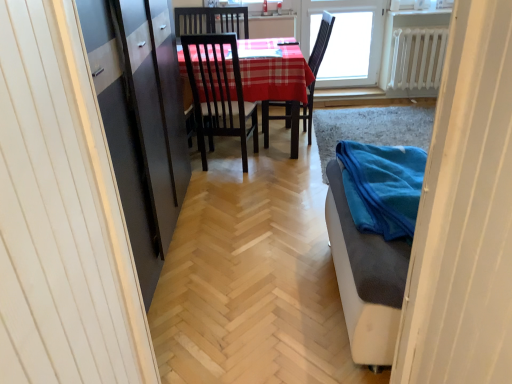
Where is `blue fabric at lower right`? This screenshot has height=384, width=512. blue fabric at lower right is located at coordinates (464, 214).

In order to face blue fabric at lower right, should I rotate leftwards or rightwards?

To align with it, rotate right about 19.150°.

The width and height of the screenshot is (512, 384). What do you see at coordinates (345, 40) in the screenshot?
I see `transparent glass window at upper center` at bounding box center [345, 40].

Where is `blue fabric at lower right`? blue fabric at lower right is located at coordinates (464, 214).

Is white metallic radiator at upper right touching transparent glass window at upper center?

white metallic radiator at upper right and transparent glass window at upper center are clearly separated.

Is white metallic radiator at upper right in front of or behind transparent glass window at upper center in the image?

white metallic radiator at upper right is in front of transparent glass window at upper center.

In the scene shown: Is white metallic radiator at upper right shorter than transparent glass window at upper center?

Yes.

You are a GUI agent. You are given a task and a screenshot of the screen. Output one action in this format:
    pyautogui.click(x=<x>, y=<y>)
    Task: Click on the radiator on the right of the transparent glass window at upper center
    The height and width of the screenshot is (384, 512).
    Given the screenshot: What is the action you would take?
    pyautogui.click(x=416, y=60)

Considering the positions of objects blue fabric at lower right and white metallic radiator at upper right in the image provided, who is more to the right, blue fabric at lower right or white metallic radiator at upper right?

From the viewer's perspective, white metallic radiator at upper right appears more on the right side.

From a real-world perspective, does blue fabric at lower right sit lower than white metallic radiator at upper right?

Yes.

In the scene shown: From the image's perspective, which is above, blue fabric at lower right or white metallic radiator at upper right?

white metallic radiator at upper right, from the image's perspective.

Considering their positions, is blue fabric at lower right located in front of or behind white metallic radiator at upper right?

blue fabric at lower right is positioned closer to the viewer than white metallic radiator at upper right.

From the picture: From a real-world perspective, is blue fabric at lower right located higher than transparent glass window at upper center?

No, from a real-world perspective, blue fabric at lower right is not above transparent glass window at upper center.

How much distance is there between blue fabric at lower right and transparent glass window at upper center?

blue fabric at lower right and transparent glass window at upper center are 11.35 feet apart.

Is blue fabric at lower right inside the boundaries of transparent glass window at upper center, or outside?

blue fabric at lower right is not inside transparent glass window at upper center, it's outside.

Is blue fabric at lower right in front of transparent glass window at upper center?

Yes, it is in front of transparent glass window at upper center.

Based on the photo, considering the positions of objects transparent glass window at upper center and blue fabric at lower right in the image provided, who is more to the left, transparent glass window at upper center or blue fabric at lower right?

blue fabric at lower right is more to the left.

Is transparent glass window at upper center outside of blue fabric at lower right?

Yes, transparent glass window at upper center is not within blue fabric at lower right.

Can you confirm if transparent glass window at upper center is shorter than blue fabric at lower right?

Yes, transparent glass window at upper center is shorter than blue fabric at lower right.

Does transparent glass window at upper center have a larger size compared to blue fabric at lower right?

No, transparent glass window at upper center is not bigger than blue fabric at lower right.

From the picture: Is white metallic radiator at upper right inside or outside of blue fabric at lower right?

white metallic radiator at upper right is not enclosed by blue fabric at lower right.

Which is closer to the camera, [397,76] or [402,307]?

Point [397,76] appears to be farther away from the viewer than point [402,307].

Considering the sizes of objects white metallic radiator at upper right and blue fabric at lower right in the image provided, who is thinner, white metallic radiator at upper right or blue fabric at lower right?

white metallic radiator at upper right is thinner.

Considering the positions of objects transparent glass window at upper center and white metallic radiator at upper right in the image provided, who is more to the right, transparent glass window at upper center or white metallic radiator at upper right?

white metallic radiator at upper right.

From the picture: From a real-world perspective, is transparent glass window at upper center under white metallic radiator at upper right?

No.

Does transparent glass window at upper center have a smaller size compared to white metallic radiator at upper right?

No.

Can you tell me how much transparent glass window at upper center and white metallic radiator at upper right differ in facing direction?

0.0127 degrees.

The height and width of the screenshot is (384, 512). Identify the location of radiator directly beneath the transparent glass window at upper center (from a real-world perspective). (416, 60).

Identify the location of radiator behind the blue fabric at lower right. (416, 60).

Considering their positions, is white metallic radiator at upper right positioned further to blue fabric at lower right than transparent glass window at upper center?

white metallic radiator at upper right is further to blue fabric at lower right.

Which object lies nearer to the anchor point transparent glass window at upper center, white metallic radiator at upper right or blue fabric at lower right?

white metallic radiator at upper right.

Considering their positions, is transparent glass window at upper center positioned closer to blue fabric at lower right than white metallic radiator at upper right?

The object closer to blue fabric at lower right is transparent glass window at upper center.

Looking at the image, which one is located closer to white metallic radiator at upper right, blue fabric at lower right or transparent glass window at upper center?

transparent glass window at upper center is closer to white metallic radiator at upper right.

Estimate the real-world distances between objects in this image. Which object is closer to white metallic radiator at upper right, transparent glass window at upper center or blue fabric at lower right?

transparent glass window at upper center is closer to white metallic radiator at upper right.

From the image, which object appears to be nearer to transparent glass window at upper center, blue fabric at lower right or white metallic radiator at upper right?

white metallic radiator at upper right.

Identify the location of radiator between blue fabric at lower right and transparent glass window at upper center in the front-back direction. Image resolution: width=512 pixels, height=384 pixels. (416, 60).